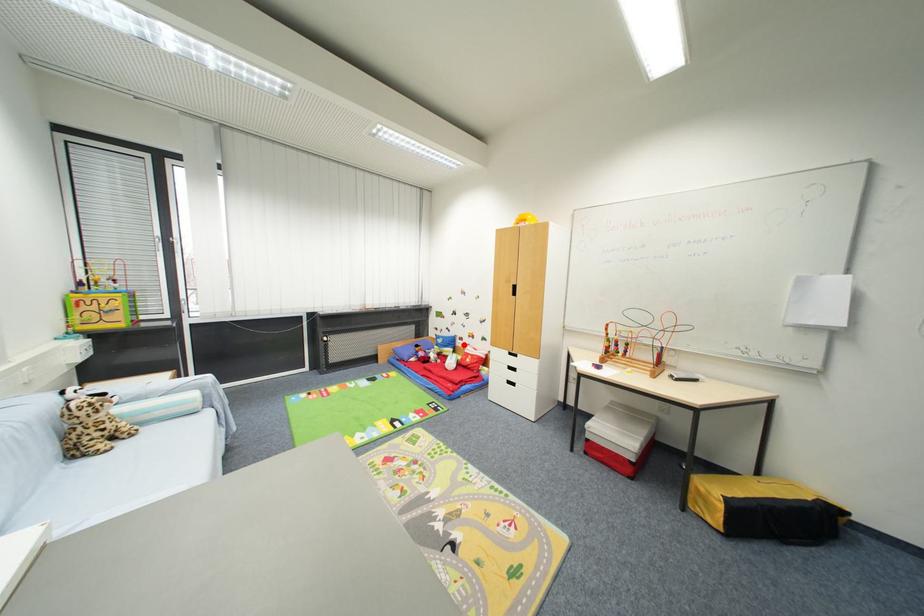
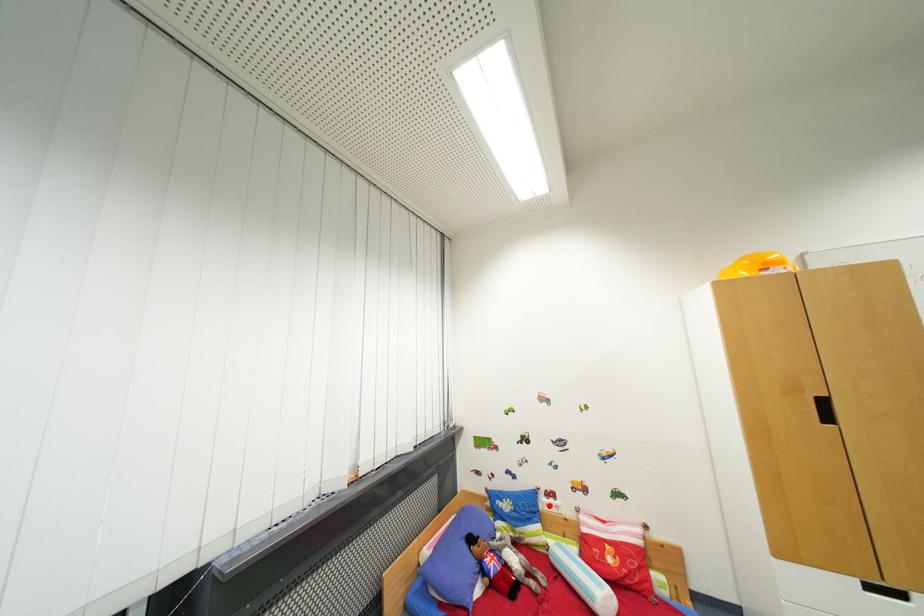
I am providing you with two images of the same scene from different viewpoints. A red point is marked on the first image and another point is marked on the second image. Are the points marked in image1 and image2 representing the same 3D position?

Yes